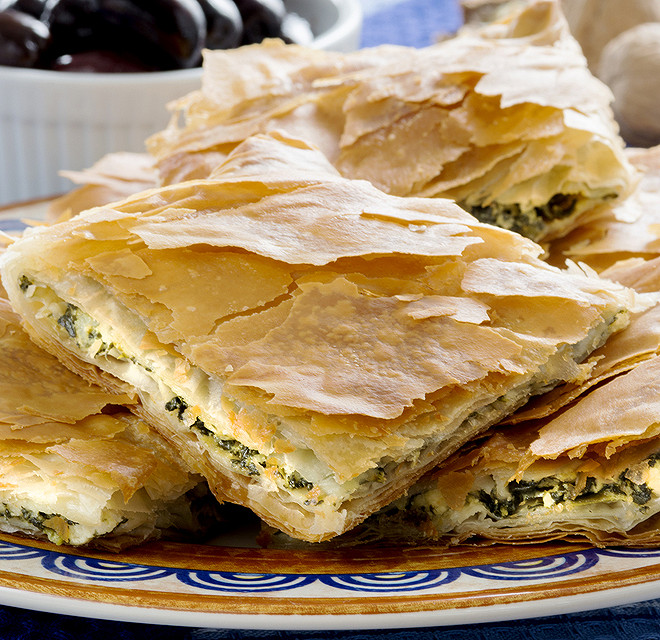
This screenshot has width=660, height=640. I want to click on brown interior edge of plate design, so click(x=212, y=554), click(x=261, y=548), click(x=341, y=564), click(x=266, y=555), click(x=488, y=553), click(x=508, y=552), click(x=183, y=550), click(x=162, y=552).